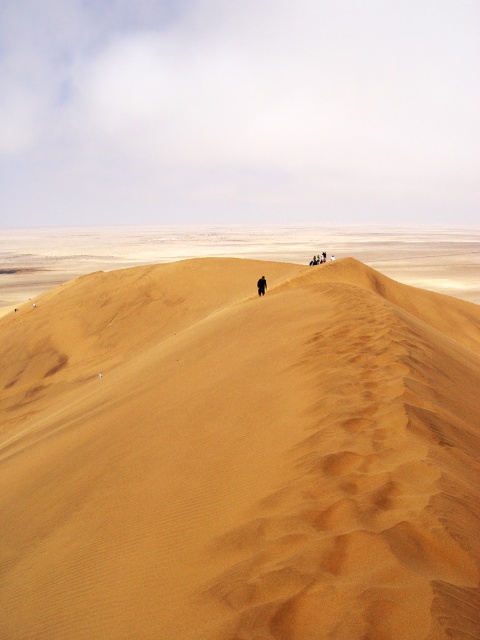
You are a hiker planning to climb the sandy yellow dune at center and the brown textured sand dune at upper center. Which dune should you choose if you want to reach the higher elevation?

The sandy yellow dune at center is taller than the brown textured sand dune at upper center, so you should choose the sandy yellow dune at center to reach the higher elevation.